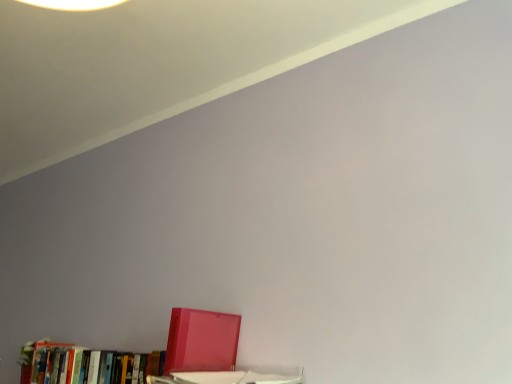
Question: In terms of height, does matte red book at lower left, the second book in the right-to-left sequence, look taller or shorter compared to glossy plastic binder at lower left, acting as the 2th book starting from the left?

Choices:
 (A) short
 (B) tall

Answer: (A)

Question: Is matte red book at lower left, the second book in the right-to-left sequence, situated inside glossy plastic binder at lower left, acting as the 2th book starting from the left, or outside?

Choices:
 (A) inside
 (B) outside

Answer: (B)

Question: Considering their positions, is matte red book at lower left, placed as the first book when sorted from left to right, located in front of or behind glossy plastic binder at lower left, acting as the first book starting from the right?

Choices:
 (A) front
 (B) behind

Answer: (B)

Question: Relative to matte red book at lower left, the second book in the right-to-left sequence, is glossy plastic binder at lower left, acting as the first book starting from the right, in front or behind?

Choices:
 (A) behind
 (B) front

Answer: (B)

Question: In terms of width, does glossy plastic binder at lower left, acting as the 2th book starting from the left, look wider or thinner when compared to matte red book at lower left, the second book in the right-to-left sequence?

Choices:
 (A) thin
 (B) wide

Answer: (B)

Question: From a real-world perspective, is glossy plastic binder at lower left, acting as the first book starting from the right, physically located above or below matte red book at lower left, placed as the first book when sorted from left to right?

Choices:
 (A) below
 (B) above

Answer: (B)

Question: In the image, is glossy plastic binder at lower left, acting as the 2th book starting from the left, on the left side or the right side of matte red book at lower left, the second book in the right-to-left sequence?

Choices:
 (A) right
 (B) left

Answer: (A)